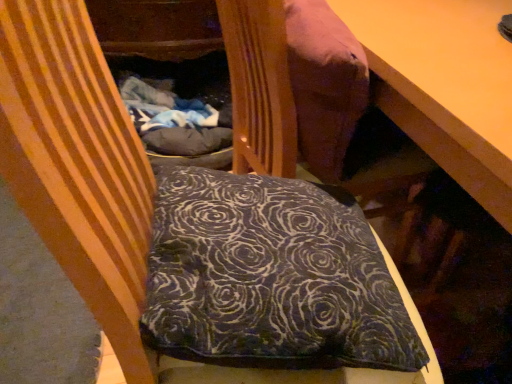
Question: Is dark blue velvety pillow at center inside the boundaries of velvet-like brown bean bag at upper center, or outside?

Choices:
 (A) outside
 (B) inside

Answer: (A)

Question: Looking at the image, does dark blue velvety pillow at center seem bigger or smaller compared to velvet-like brown bean bag at upper center?

Choices:
 (A) big
 (B) small

Answer: (B)

Question: From a real-world perspective, relative to velvet-like brown bean bag at upper center, is dark blue velvety pillow at center vertically above or below?

Choices:
 (A) below
 (B) above

Answer: (A)

Question: Based on their sizes in the image, would you say velvet-like brown bean bag at upper center is bigger or smaller than dark blue velvety pillow at center?

Choices:
 (A) small
 (B) big

Answer: (B)

Question: Is velvet-like brown bean bag at upper center wider or thinner than dark blue velvety pillow at center?

Choices:
 (A) wide
 (B) thin

Answer: (B)

Question: Considering the positions of point (278, 34) and point (325, 200), is point (278, 34) closer or farther from the camera than point (325, 200)?

Choices:
 (A) farther
 (B) closer

Answer: (B)

Question: Is velvet-like brown bean bag at upper center in front of or behind dark blue velvety pillow at center in the image?

Choices:
 (A) front
 (B) behind

Answer: (B)